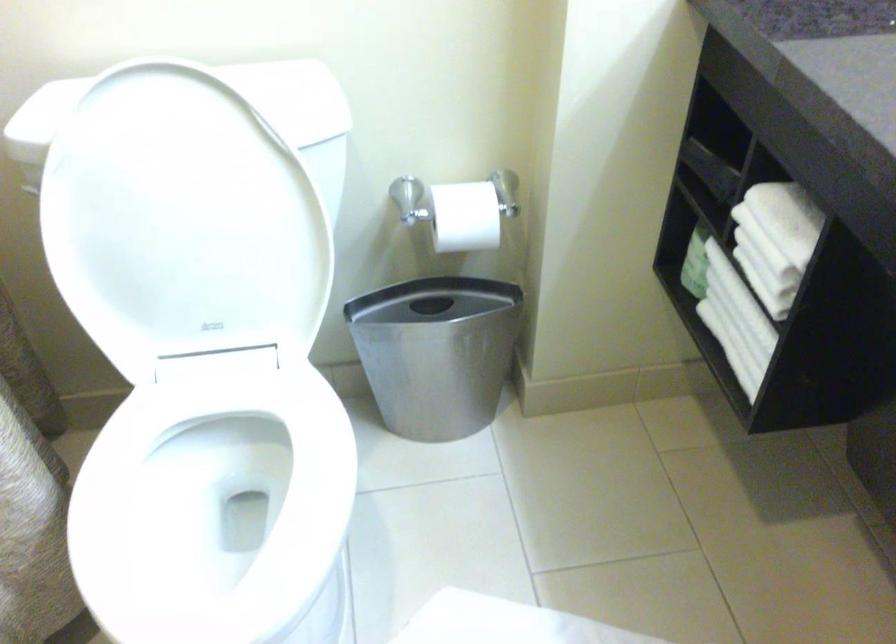
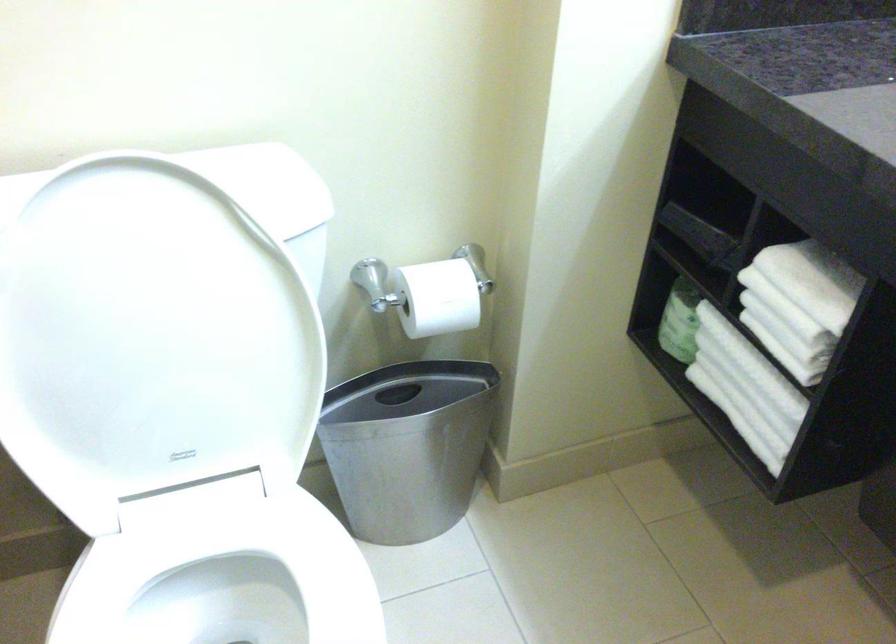
Locate, in the second image, the point that corresponds to [245,440] in the first image.

(225, 581)